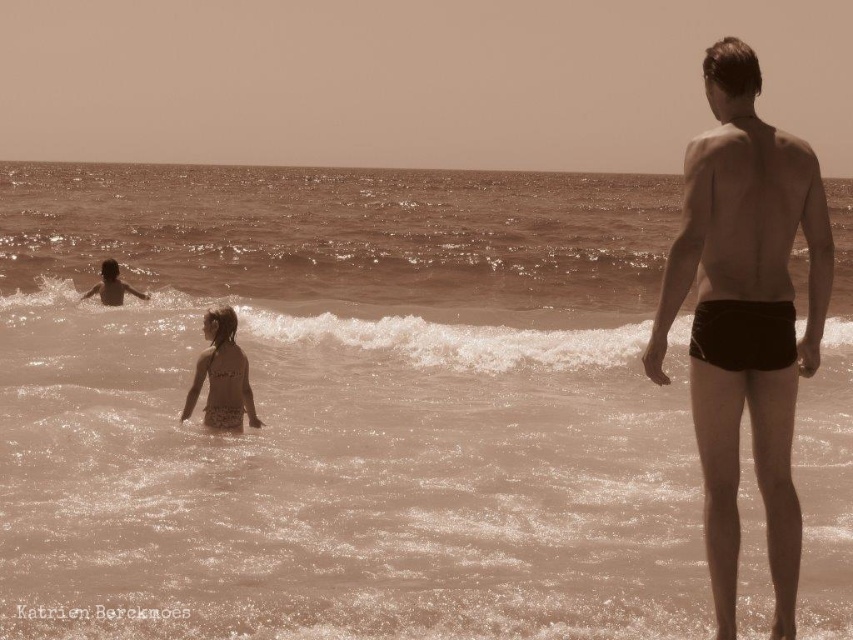
Question: Is brown water at center further to camera compared to smooth skin child at left?

Choices:
 (A) yes
 (B) no

Answer: (B)

Question: Which object is closer to the camera taking this photo?

Choices:
 (A) black matte shorts at right
 (B) white frothy wave at center
 (C) brown water at center

Answer: (A)

Question: Estimate the real-world distances between objects in this image. Which object is farther from the black matte shorts at right?

Choices:
 (A) beige textured swimsuit at center
 (B) smooth skin child at left
 (C) white frothy wave at center

Answer: (B)

Question: Can you confirm if brown water at center is smaller than white frothy wave at center?

Choices:
 (A) no
 (B) yes

Answer: (A)

Question: Among these objects, which one is farthest from the camera?

Choices:
 (A) brown water at center
 (B) white frothy wave at center
 (C) beige textured swimsuit at center

Answer: (B)

Question: Observing the image, what is the correct spatial positioning of brown water at center in reference to smooth skin child at left?

Choices:
 (A) left
 (B) right

Answer: (B)